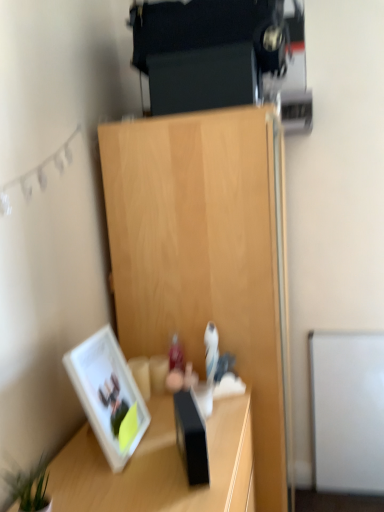
Question: From their relative heights in the image, would you say white glossy picture frame at lower left is taller or shorter than green leafy plant at lower left?

Choices:
 (A) tall
 (B) short

Answer: (A)

Question: Considering their positions, is white glossy picture frame at lower left located in front of or behind green leafy plant at lower left?

Choices:
 (A) behind
 (B) front

Answer: (A)

Question: Which object is the farthest from the wooden desk at lower left?

Choices:
 (A) white glossy picture frame at lower left
 (B) green leafy plant at lower left
 (C) light wood cabinet at center

Answer: (C)

Question: Estimate the real-world distances between objects in this image. Which object is closer to the green leafy plant at lower left?

Choices:
 (A) wooden desk at lower left
 (B) white glossy picture frame at lower left
 (C) light wood cabinet at center

Answer: (B)